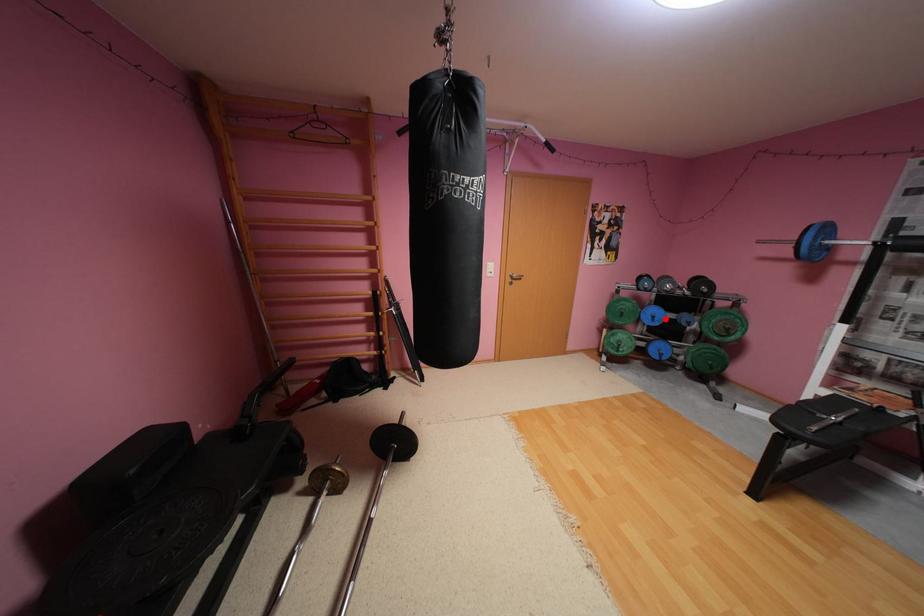
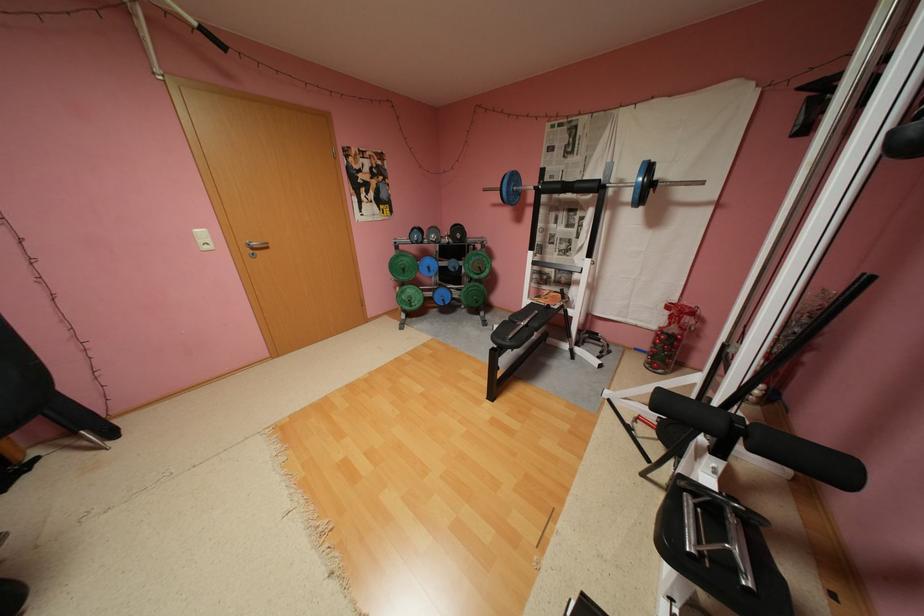
Where in the second image is the point corresponding to the highlighted location from the first image?

(441, 269)